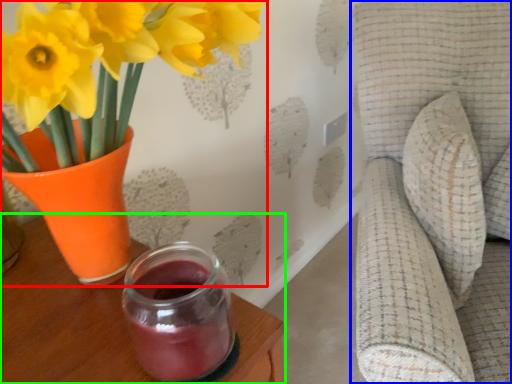
Question: Which is nearer to the houseplant (highlighted by a red box)? swivel chair (highlighted by a blue box) or table (highlighted by a green box).

Choices:
 (A) swivel chair
 (B) table

Answer: (B)